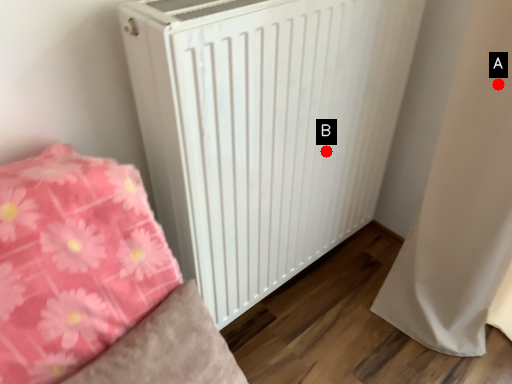
Question: Two points are circled on the image, labeled by A and B beside each circle. Among these points, which one is farthest from the camera?

Choices:
 (A) A is further
 (B) B is further

Answer: (B)